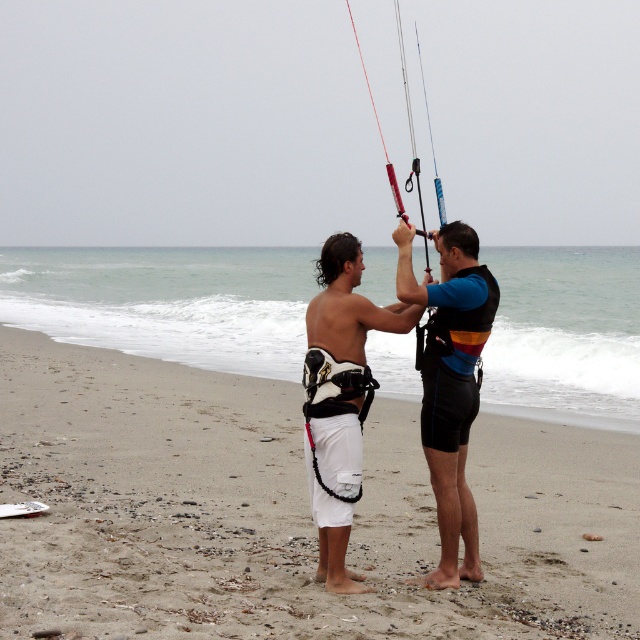
Question: Does white sand at center appear on the left side of white matte shorts at center?

Choices:
 (A) no
 (B) yes

Answer: (B)

Question: Which point is farther to the camera?

Choices:
 (A) (442, 317)
 (B) (316, 417)
 (C) (220, 552)

Answer: (C)

Question: Does white sand at center appear over white matte shorts at center?

Choices:
 (A) no
 (B) yes

Answer: (A)

Question: Estimate the real-world distances between objects in this image. Which object is closer to the black neoprene wetsuit at center?

Choices:
 (A) white matte shorts at center
 (B) white sand at center

Answer: (A)

Question: Which is nearer to the white matte shorts at center?

Choices:
 (A) white sand at center
 (B) black neoprene wetsuit at center

Answer: (B)

Question: Is white sand at center smaller than white matte shorts at center?

Choices:
 (A) no
 (B) yes

Answer: (A)